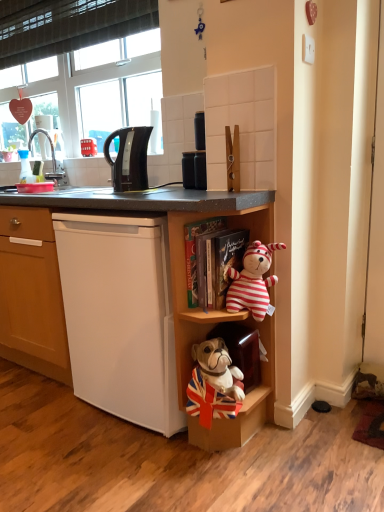
Where is `free location to the left of white matte cabinet at lower right, the 2th cabinet in the right-to-left sequence`? free location to the left of white matte cabinet at lower right, the 2th cabinet in the right-to-left sequence is located at coordinates (52, 423).